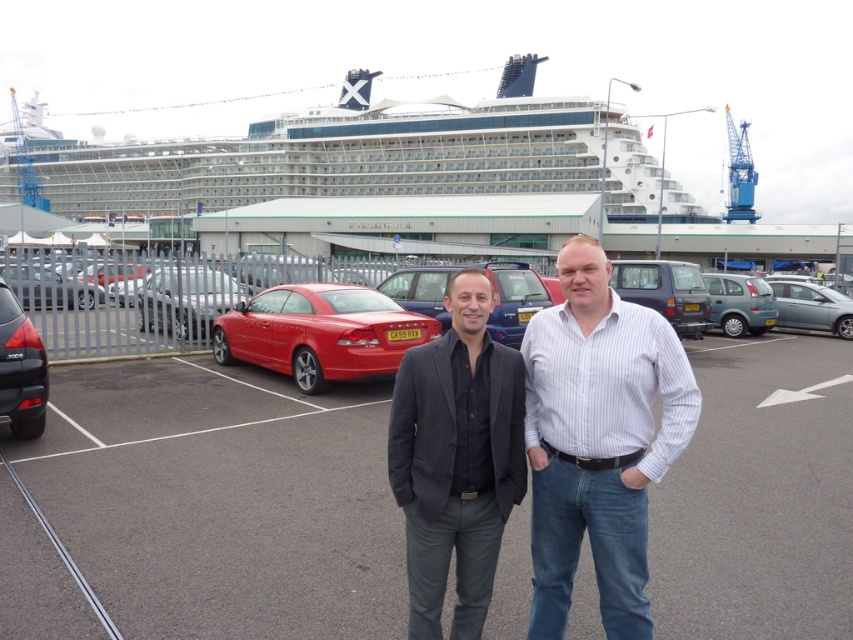
Question: Does silver metallic hatchback at center right have a lesser width compared to metallic silver sedan at center-left?

Choices:
 (A) yes
 (B) no

Answer: (A)

Question: Which object is the farthest from the metallic red sedan at center?

Choices:
 (A) gray asphalt parking lot at center
 (B) teal matte hatchback at center right
 (C) silver metallic hatchback at center right

Answer: (C)

Question: Which point appears farthest from the camera in this image?

Choices:
 (A) (840, 332)
 (B) (764, 300)
 (C) (498, 269)

Answer: (A)

Question: Can you confirm if dark grey pinstripe suit at center is positioned to the right of metallic red sedan at center?

Choices:
 (A) no
 (B) yes

Answer: (A)

Question: Which point is closer to the camera?

Choices:
 (A) (735, 282)
 (B) (804, 292)
 (C) (368, 164)
 (D) (505, 320)

Answer: (D)

Question: Is satin silver sedan at center closer to camera compared to matte gray van at center?

Choices:
 (A) yes
 (B) no

Answer: (A)